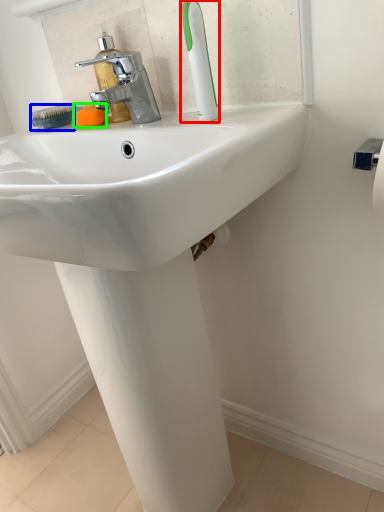
Question: Estimate the real-world distances between objects in this image. Which object is farther from toothbrush (highlighted by a red box), brush (highlighted by a blue box) or soap (highlighted by a green box)?

Choices:
 (A) brush
 (B) soap

Answer: (A)